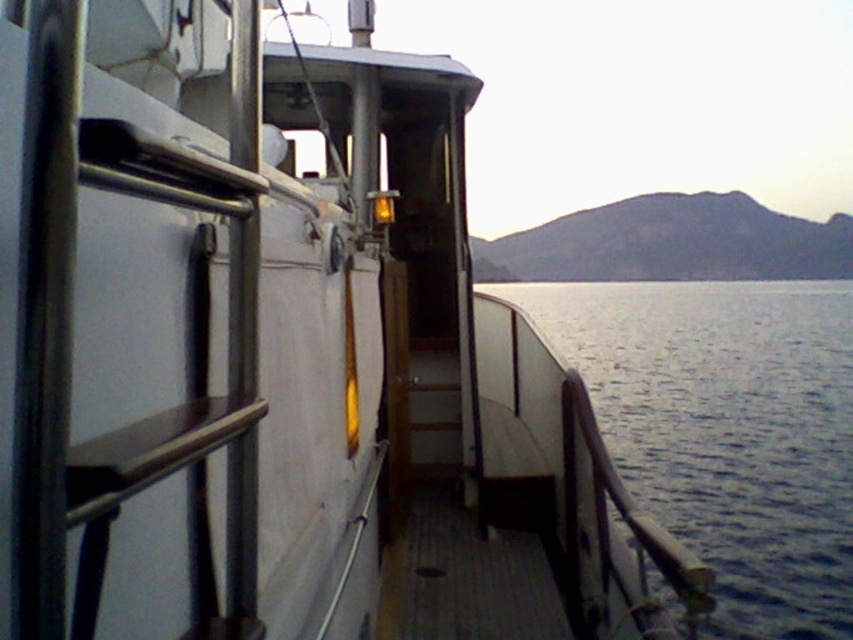
Question: Can you confirm if blue water at lower right is smaller than wooden at center?

Choices:
 (A) no
 (B) yes

Answer: (A)

Question: Is blue water at lower right thinner than wooden at center?

Choices:
 (A) no
 (B) yes

Answer: (A)

Question: Is blue water at lower right above wooden at center?

Choices:
 (A) no
 (B) yes

Answer: (B)